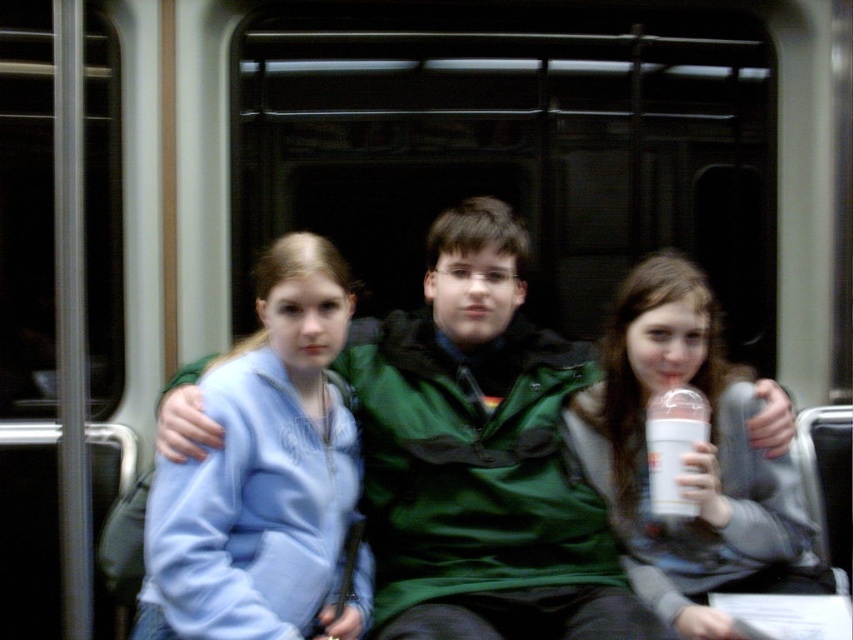
Consider the image. You are a passenger on a train and you see two items at the center of the scene. The light blue fleece at center and the white plastic bottle at center. Which item is nearer to you?

The light blue fleece at center is closer to the viewer than the white plastic bottle at center.

You are a passenger on a train and you want to place your belongings on the seat next to you without blocking the aisle. You have a light blue fleece at center and a white plastic bottle at center. Which item should you choose to place on the seat so that it doesn

The light blue fleece at center is taller than the white plastic bottle at center, so placing the shorter white plastic bottle at center on the seat would be less likely to block the aisle.